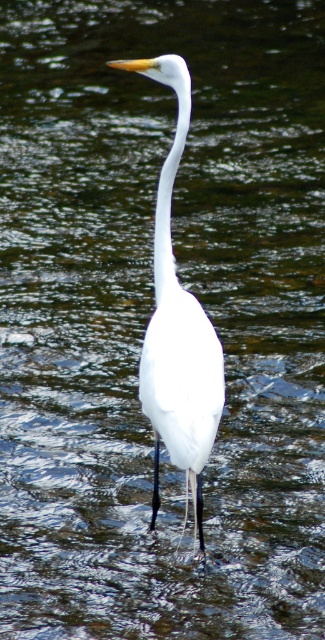
You are observing the Great Egret in the image. There are two points marked in the scene. The first point is at coordinates point (174, 326) and the second is at point (159, 218). Which of these points is nearer to the viewer?

Point (174, 326) is closer to the viewer than point (159, 218).

You are a photographer trying to capture the white smooth bird at center and the white smooth neck at center in the same frame. Considering the distance between them, can you fit both subjects into a standard camera frame that has a maximum coverage of 20 inches?

The distance between the white smooth bird at center and the white smooth neck at center is 18.05 inches, which is less than the camera frame coverage of 20 inches. Therefore, both subjects can be captured in the same frame.